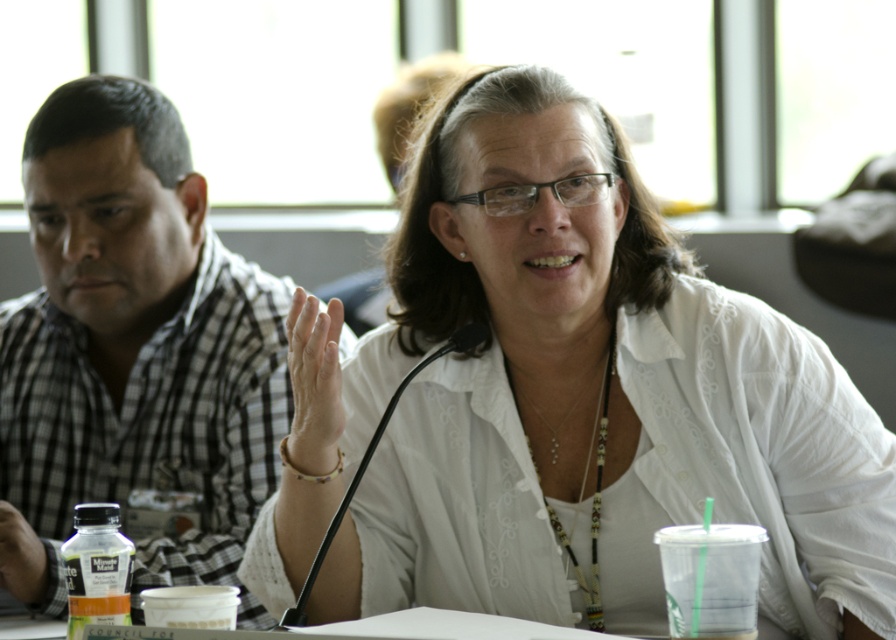
Question: Is checkered fabric shirt at left bigger than white matte hand at center?

Choices:
 (A) no
 (B) yes

Answer: (B)

Question: Which object is positioned farthest from the white matte shirt at center?

Choices:
 (A) white matte hand at center
 (B) translucent plastic bottle at lower left

Answer: (B)

Question: Is white matte hand at center below matte plastic bottle at lower left?

Choices:
 (A) no
 (B) yes

Answer: (A)

Question: Which of the following is the farthest from the observer?

Choices:
 (A) (333, 364)
 (B) (11, 528)
 (C) (208, 378)

Answer: (C)

Question: Which point appears closest to the camera in this image?

Choices:
 (A) (80, 563)
 (B) (550, 227)
 (C) (14, 515)

Answer: (A)

Question: Can you confirm if white matte hand at center is positioned above matte plastic bottle at lower left?

Choices:
 (A) yes
 (B) no

Answer: (A)